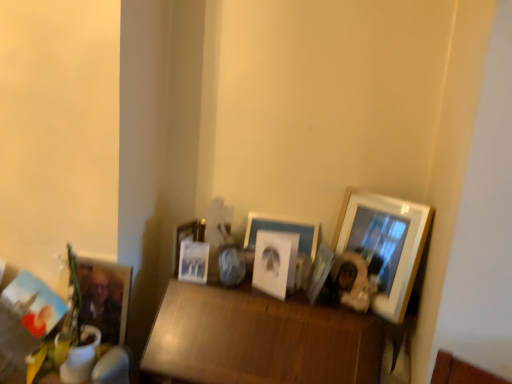
Looking at this image, how much space does metallic silver photo frame at center, acting as the 4th picture frame starting from the left, occupy vertically?

It is 14.99 centimeters.

What is the approximate height of matte white picture frame at center, which is the second picture frame in right-to-left order?

matte white picture frame at center, which is the second picture frame in right-to-left order, is 7.03 inches in height.

This screenshot has height=384, width=512. Describe the element at coordinates (285, 235) in the screenshot. I see `white matte picture frame at center, positioned as the fifth picture frame in left-to-right order` at that location.

Describe the element at coordinates (385, 243) in the screenshot. I see `wooden picture frame at right, which appears as the 1th picture frame when viewed from the right` at that location.

I want to click on wooden table at center, so click(x=258, y=339).

Where is `metallic silver photo frame at center, acting as the 4th picture frame starting from the left`? The width and height of the screenshot is (512, 384). metallic silver photo frame at center, acting as the 4th picture frame starting from the left is located at coordinates (193, 261).

Which object is closer to the camera taking this photo, white matte picture frame at center, the 4th picture frame in the right-to-left sequence, or matte white picture frame at center, positioned as the sixth picture frame in right-to-left order?

Positioned in front is matte white picture frame at center, positioned as the sixth picture frame in right-to-left order.

Which object is positioned more to the right, white matte picture frame at center, the 4th picture frame in the right-to-left sequence, or matte white picture frame at center, positioned as the 3th picture frame in left-to-right order?

white matte picture frame at center, the 4th picture frame in the right-to-left sequence, is more to the right.

Is white matte picture frame at center, positioned as the fifth picture frame in left-to-right order, outside of matte white picture frame at center, positioned as the sixth picture frame in right-to-left order?

white matte picture frame at center, positioned as the fifth picture frame in left-to-right order, is positioned outside matte white picture frame at center, positioned as the sixth picture frame in right-to-left order.

Which object is thinner, metallic silver photo frame at center, acting as the 4th picture frame starting from the left, or matte white picture frame at center, positioned as the 3th picture frame in left-to-right order?

matte white picture frame at center, positioned as the 3th picture frame in left-to-right order.

Which is closer, [181,268] or [183,224]?

The point [181,268] is closer.

Based on the photo, which of these two, metallic silver photo frame at center, acting as the 4th picture frame starting from the left, or matte white picture frame at center, positioned as the sixth picture frame in right-to-left order, is smaller?

Smaller between the two is metallic silver photo frame at center, acting as the 4th picture frame starting from the left.

Does matte white picture frame at center, positioned as the sixth picture frame in right-to-left order, turn towards matte black picture frame at lower left, the 8th picture frame positioned from the right?

No, matte white picture frame at center, positioned as the sixth picture frame in right-to-left order, is not facing towards matte black picture frame at lower left, the 8th picture frame positioned from the right.

Can you confirm if matte white picture frame at center, positioned as the 3th picture frame in left-to-right order, is wider than matte black picture frame at lower left, the 8th picture frame positioned from the right?

No.

From the image's perspective, does matte white picture frame at center, positioned as the sixth picture frame in right-to-left order, appear lower than matte black picture frame at lower left, the 8th picture frame positioned from the right?

Incorrect, from the image's perspective, matte white picture frame at center, positioned as the sixth picture frame in right-to-left order, is higher than matte black picture frame at lower left, the 8th picture frame positioned from the right.

How different are the orientations of matte white picture frame at center, positioned as the sixth picture frame in right-to-left order, and matte black picture frame at lower left, the 8th picture frame positioned from the right, in degrees?

There is a 76.5-degree angle between the facing directions of matte white picture frame at center, positioned as the sixth picture frame in right-to-left order, and matte black picture frame at lower left, the 8th picture frame positioned from the right.

Measure the distance between wooden picture frame at right, arranged as the 8th picture frame when viewed from the left, and white paper at center, positioned as the 6th picture frame in left-to-right order.

They are 11.26 inches apart.

From the image's perspective, is wooden picture frame at right, which appears as the 1th picture frame when viewed from the right, beneath white paper at center, positioned as the 6th picture frame in left-to-right order?

Actually, wooden picture frame at right, which appears as the 1th picture frame when viewed from the right, appears above white paper at center, positioned as the 6th picture frame in left-to-right order, in the image.

Considering the positions of objects wooden picture frame at right, which appears as the 1th picture frame when viewed from the right, and white paper at center, which is counted as the third picture frame, starting from the right, in the image provided, who is in front, wooden picture frame at right, which appears as the 1th picture frame when viewed from the right, or white paper at center, which is counted as the third picture frame, starting from the right,?

wooden picture frame at right, which appears as the 1th picture frame when viewed from the right, is more forward.

Is point (333, 243) behind point (264, 258)?

That is True.

Are white matte picture frame at center, the 4th picture frame in the right-to-left sequence, and metallic silver photo frame at center, the 5th picture frame positioned from the right, beside each other?

No, white matte picture frame at center, the 4th picture frame in the right-to-left sequence, is not touching metallic silver photo frame at center, the 5th picture frame positioned from the right.

Which is more to the right, white matte picture frame at center, positioned as the fifth picture frame in left-to-right order, or metallic silver photo frame at center, acting as the 4th picture frame starting from the left?

white matte picture frame at center, positioned as the fifth picture frame in left-to-right order, is more to the right.

Who is more distant, white matte picture frame at center, the 4th picture frame in the right-to-left sequence, or metallic silver photo frame at center, the 5th picture frame positioned from the right?

white matte picture frame at center, the 4th picture frame in the right-to-left sequence, is further away from the camera.

Can you confirm if white matte picture frame at center, positioned as the fifth picture frame in left-to-right order, is wider than metallic silver photo frame at center, the 5th picture frame positioned from the right?

Indeed, white matte picture frame at center, positioned as the fifth picture frame in left-to-right order, has a greater width compared to metallic silver photo frame at center, the 5th picture frame positioned from the right.

Which object is positioned more to the left, metallic silver photo frame at center, acting as the 4th picture frame starting from the left, or white matte picture frame at center, the 4th picture frame in the right-to-left sequence?

metallic silver photo frame at center, acting as the 4th picture frame starting from the left.

Could you tell me if metallic silver photo frame at center, the 5th picture frame positioned from the right, is turned towards white matte picture frame at center, the 4th picture frame in the right-to-left sequence?

No, metallic silver photo frame at center, the 5th picture frame positioned from the right, is not aimed at white matte picture frame at center, the 4th picture frame in the right-to-left sequence.

Which of these two, metallic silver photo frame at center, acting as the 4th picture frame starting from the left, or white matte picture frame at center, the 4th picture frame in the right-to-left sequence, stands taller?

Standing taller between the two is white matte picture frame at center, the 4th picture frame in the right-to-left sequence.

Locate an element on the screen. The width and height of the screenshot is (512, 384). picture frame that is the 1st one when counting downward from the white matte picture frame at center, the 4th picture frame in the right-to-left sequence (from the image's perspective) is located at coordinates [193, 261].

Would you say wooden table at center is outside metallic silver photo frame at center, acting as the 4th picture frame starting from the left?

That's correct, wooden table at center is outside of metallic silver photo frame at center, acting as the 4th picture frame starting from the left.

Considering the positions of objects wooden table at center and metallic silver photo frame at center, the 5th picture frame positioned from the right, in the image provided, who is in front, wooden table at center or metallic silver photo frame at center, the 5th picture frame positioned from the right,?

Positioned in front is wooden table at center.

From the picture: Considering the relative sizes of wooden table at center and metallic silver photo frame at center, acting as the 4th picture frame starting from the left, in the image provided, is wooden table at center smaller than metallic silver photo frame at center, acting as the 4th picture frame starting from the left,?

No, wooden table at center is not smaller than metallic silver photo frame at center, acting as the 4th picture frame starting from the left.

Can you tell me how much wooden table at center and metallic silver photo frame at center, acting as the 4th picture frame starting from the left, differ in facing direction?

10.5 degrees.

Find the location of `the 2nd picture frame counting from the left side of the white matte picture frame at center, positioned as the fifth picture frame in left-to-right order`. the 2nd picture frame counting from the left side of the white matte picture frame at center, positioned as the fifth picture frame in left-to-right order is located at coordinates (187, 237).

Locate an element on the screen. This screenshot has width=512, height=384. the 2nd picture frame directly above the metallic silver photo frame at center, the 5th picture frame positioned from the right (from a real-world perspective) is located at coordinates (187, 237).

Considering their positions, is matte black picture frame at lower left, the 8th picture frame positioned from the right, positioned closer to metallic silver photo frame at center, the 5th picture frame positioned from the right, than white matte picture frame at center, positioned as the fifth picture frame in left-to-right order?

white matte picture frame at center, positioned as the fifth picture frame in left-to-right order, is closer to metallic silver photo frame at center, the 5th picture frame positioned from the right.

When comparing their distances from white paper at center, which is counted as the third picture frame, starting from the right, does matte white picture frame at center, positioned as the sixth picture frame in right-to-left order, or metallic silver photo frame at center, acting as the 4th picture frame starting from the left, seem closer?

metallic silver photo frame at center, acting as the 4th picture frame starting from the left, is closer to white paper at center, which is counted as the third picture frame, starting from the right.

Considering their positions, is white paper at center, positioned as the 6th picture frame in left-to-right order, positioned closer to metallic silver photo frame at center, the 5th picture frame positioned from the right, than white matte picture frame at center, positioned as the fifth picture frame in left-to-right order?

Among the two, white paper at center, positioned as the 6th picture frame in left-to-right order, is located nearer to metallic silver photo frame at center, the 5th picture frame positioned from the right.

Based on their spatial positions, is metallic silver photo frame at center, the 5th picture frame positioned from the right, or white matte picture frame at center, the 4th picture frame in the right-to-left sequence, closer to matte black picture frame at lower left, the 8th picture frame positioned from the right?

metallic silver photo frame at center, the 5th picture frame positioned from the right, lies closer to matte black picture frame at lower left, the 8th picture frame positioned from the right, than the other object.

Estimate the real-world distances between objects in this image. Which object is further from wooden picture frame at right, which appears as the 1th picture frame when viewed from the right, wooden table at center or matte black picture frame at lower left, the 8th picture frame positioned from the right?

matte black picture frame at lower left, the 8th picture frame positioned from the right.

Which object lies nearer to the anchor point matte black picture frame at lower left, placed as the first picture frame when sorted from left to right, metallic silver photo frame at center, the 5th picture frame positioned from the right, or white paper at center, positioned as the 6th picture frame in left-to-right order?

metallic silver photo frame at center, the 5th picture frame positioned from the right, is closer to matte black picture frame at lower left, placed as the first picture frame when sorted from left to right.

Estimate the real-world distances between objects in this image. Which object is further from matte white picture frame at center, which is the second picture frame in right-to-left order, metallic silver photo frame at center, the 5th picture frame positioned from the right, or matte wooden picture frame at lower left, the 2th picture frame from the left?

Among the two, matte wooden picture frame at lower left, the 2th picture frame from the left, is located further to matte white picture frame at center, which is the second picture frame in right-to-left order.

Which object lies nearer to the anchor point wooden picture frame at right, which appears as the 1th picture frame when viewed from the right, matte wooden picture frame at lower left, which appears as the seventh picture frame when viewed from the right, or matte white picture frame at center, positioned as the sixth picture frame in right-to-left order?

matte white picture frame at center, positioned as the sixth picture frame in right-to-left order, is closer to wooden picture frame at right, which appears as the 1th picture frame when viewed from the right.

Find the location of a particular element. This screenshot has height=384, width=512. table situated between matte wooden picture frame at lower left, which appears as the seventh picture frame when viewed from the right, and wooden picture frame at right, which appears as the 1th picture frame when viewed from the right, from left to right is located at coordinates (258, 339).

Image resolution: width=512 pixels, height=384 pixels. I want to click on picture frame located between metallic silver photo frame at center, acting as the 4th picture frame starting from the left, and white paper at center, which is counted as the third picture frame, starting from the right, in the left-right direction, so click(285, 235).

Locate an element on the screen. picture frame between matte black picture frame at lower left, placed as the first picture frame when sorted from left to right, and matte white picture frame at center, positioned as the 3th picture frame in left-to-right order, in the horizontal direction is located at coordinates (105, 297).

I want to click on table between matte white picture frame at center, positioned as the sixth picture frame in right-to-left order, and wooden picture frame at right, which appears as the 1th picture frame when viewed from the right, so click(258, 339).